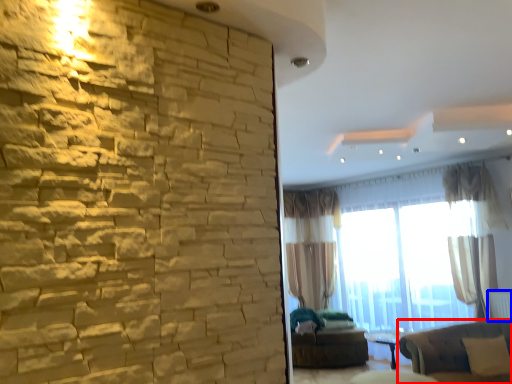
Question: Which point is further to the camera, studio couch (highlighted by a red box) or radiator (highlighted by a blue box)?

Choices:
 (A) studio couch
 (B) radiator

Answer: (B)